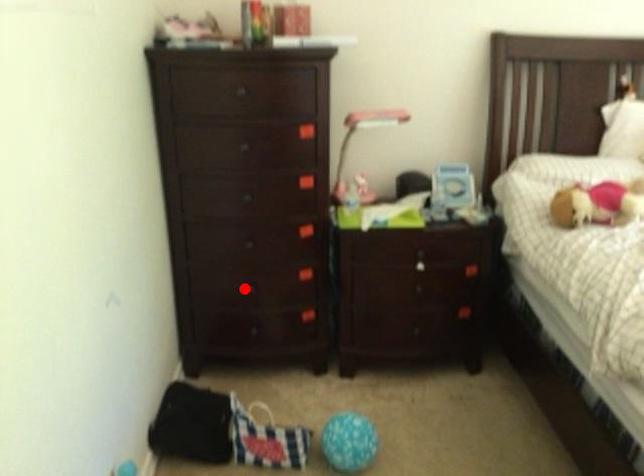
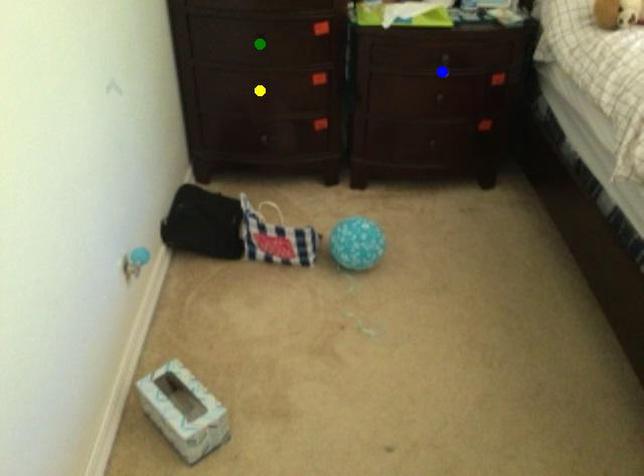
Question: I am providing you with two images of the same scene from different viewpoints. A red point is marked on the first image. You are given multiple points on the second image. Which mark in image 2 goes with the point in image 1?

Choices:
 (A) blue point
 (B) green point
 (C) yellow point

Answer: (C)